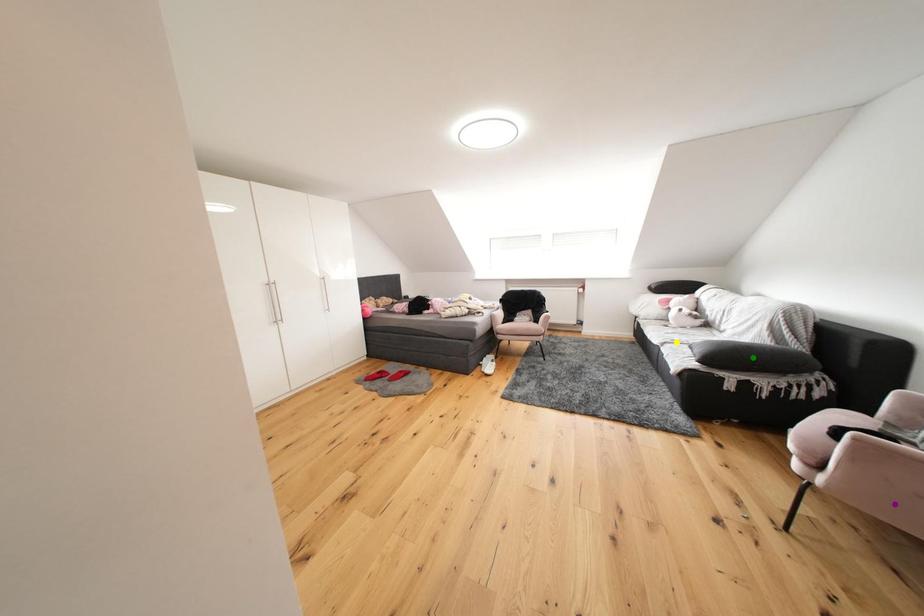
Order these from nearest to farthest:
purple point
yellow point
green point

purple point, green point, yellow point